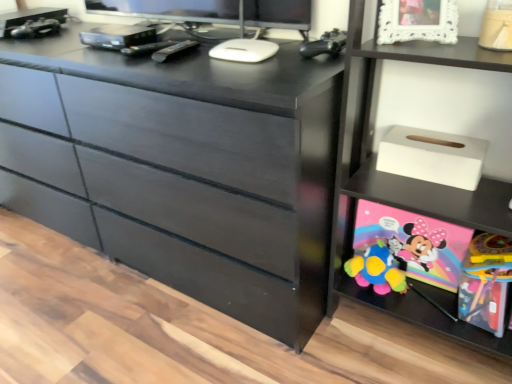
Image resolution: width=512 pixels, height=384 pixels. Find the location of `matte black dresser at center`. matte black dresser at center is located at coordinates (182, 169).

You are a GUI agent. You are given a task and a screenshot of the screen. Output one action in this format:
    pyautogui.click(x=<x>, y=<y>)
    Task: Click on the black plastic remote at center
    The width and height of the screenshot is (512, 384).
    Given the screenshot: What is the action you would take?
    pyautogui.click(x=174, y=50)

Measure the distance between black matte controller at upper right, the first toy viewed from the left, and camera.

black matte controller at upper right, the first toy viewed from the left, and camera are 1.05 meters apart.

Image resolution: width=512 pixels, height=384 pixels. Describe the element at coordinates (324, 44) in the screenshot. I see `black matte controller at upper right, which is the first toy from top to bottom` at that location.

This screenshot has height=384, width=512. What do you see at coordinates (485, 282) in the screenshot?
I see `rubberized plastic toy at lower right, the first toy from the bottom` at bounding box center [485, 282].

Image resolution: width=512 pixels, height=384 pixels. Identify the location of white matte tissue box at upper right. (432, 156).

Is white matte tissue box at upper right to the left or to the right of white matte tissue box at right in the image?

white matte tissue box at upper right is to the left of white matte tissue box at right.

Which is closer, (x=453, y=185) or (x=474, y=206)?

Point (x=453, y=185) is farther from the camera than point (x=474, y=206).

Is white matte tissue box at upper right behind white matte tissue box at right?

Yes, white matte tissue box at upper right is behind white matte tissue box at right.

Looking at this image, is white matte tissue box at upper right smaller than white matte tissue box at right?

Yes, white matte tissue box at upper right is smaller than white matte tissue box at right.

Can you confirm if white matte tissue box at right is smaller than black matte controller at upper right, which is the first toy from top to bottom?

No.

Could you tell me if white matte tissue box at right is facing black matte controller at upper right, the first toy viewed from the left?

No, white matte tissue box at right does not turn towards black matte controller at upper right, the first toy viewed from the left.

Considering the relative sizes of white matte tissue box at right and black matte controller at upper right, which is the first toy from top to bottom, in the image provided, is white matte tissue box at right taller than black matte controller at upper right, which is the first toy from top to bottom,?

Correct, white matte tissue box at right is much taller as black matte controller at upper right, which is the first toy from top to bottom.

Considering their positions, is white matte tissue box at right located in front of or behind black matte controller at upper right, the first toy viewed from the left?

In the image, white matte tissue box at right appears in front of black matte controller at upper right, the first toy viewed from the left.

Considering the relative positions of white lace picture frame at upper right and white matte tissue box at upper right in the image provided, is white lace picture frame at upper right in front of white matte tissue box at upper right?

Yes, it is in front of white matte tissue box at upper right.

Which is correct: white lace picture frame at upper right is inside white matte tissue box at upper right, or outside of it?

white lace picture frame at upper right is not enclosed by white matte tissue box at upper right.

Can you tell me how much white lace picture frame at upper right and white matte tissue box at upper right differ in facing direction?

They differ by 29 degrees in their facing directions.

From the picture: Considering the positions of objects white lace picture frame at upper right and white matte tissue box at upper right in the image provided, who is more to the left, white lace picture frame at upper right or white matte tissue box at upper right?

From the viewer's perspective, white lace picture frame at upper right appears more on the left side.

How much distance is there between black matte controller at upper right, placed as the 2th toy when sorted from right to left, and rubberized plastic toy at lower right, the first toy positioned from the right?

The distance of black matte controller at upper right, placed as the 2th toy when sorted from right to left, from rubberized plastic toy at lower right, the first toy positioned from the right, is 27.04 inches.

From the image's perspective, is black matte controller at upper right, which is the first toy from top to bottom, above or below rubberized plastic toy at lower right, the first toy positioned from the right?

Based on their image positions, black matte controller at upper right, which is the first toy from top to bottom, is located above rubberized plastic toy at lower right, the first toy positioned from the right.

Which object is positioned more to the left, black matte controller at upper right, placed as the 2th toy when sorted from right to left, or rubberized plastic toy at lower right, the first toy from the bottom?

Positioned to the left is black matte controller at upper right, placed as the 2th toy when sorted from right to left.

Where is `toy above the rubberized plastic toy at lower right, the 2th toy in the top-to-bottom sequence (from the image's perspective)`? toy above the rubberized plastic toy at lower right, the 2th toy in the top-to-bottom sequence (from the image's perspective) is located at coordinates (324, 44).

Who is more distant, white matte tissue box at right or white matte tissue box at upper right?

Positioned behind is white matte tissue box at upper right.

Considering the relative sizes of white matte tissue box at right and white matte tissue box at upper right in the image provided, is white matte tissue box at right smaller than white matte tissue box at upper right?

No, white matte tissue box at right is not smaller than white matte tissue box at upper right.

Does white matte tissue box at right appear on the right side of white matte tissue box at upper right?

Correct, you'll find white matte tissue box at right to the right of white matte tissue box at upper right.

Does white matte tissue box at right contain white matte tissue box at upper right?

That's correct, white matte tissue box at upper right is inside white matte tissue box at right.

Can we say white lace picture frame at upper right lies outside matte black dresser at center?

Indeed, white lace picture frame at upper right is completely outside matte black dresser at center.

Which is behind, white lace picture frame at upper right or matte black dresser at center?

white lace picture frame at upper right is further away from the camera.

Does white lace picture frame at upper right appear on the left side of matte black dresser at center?

No.

How different are the orientations of rubberized plastic toy at lower right, the 2th toy in the top-to-bottom sequence, and matte black dresser at center in degrees?

rubberized plastic toy at lower right, the 2th toy in the top-to-bottom sequence, and matte black dresser at center are facing 5.12e-05 degrees away from each other.

In the scene shown: Would you consider rubberized plastic toy at lower right, the first toy positioned from the right, to be distant from matte black dresser at center?

That's not correct — rubberized plastic toy at lower right, the first toy positioned from the right, is a little close to matte black dresser at center.

Considering the sizes of rubberized plastic toy at lower right, the first toy positioned from the right, and matte black dresser at center in the image, is rubberized plastic toy at lower right, the first toy positioned from the right, bigger or smaller than matte black dresser at center?

Considering their sizes, rubberized plastic toy at lower right, the first toy positioned from the right, takes up less space than matte black dresser at center.

From the matte black dresser at center, count 1st toys backward and point to it. Please provide its 2D coordinates.

[(485, 282)]

Identify the location of shelf located underneath the white matte tissue box at upper right (from a real-world perspective). This screenshot has width=512, height=384. (374, 136).

What are the coordinates of `toy to the left of white matte tissue box at right` in the screenshot? It's located at (324, 44).

Considering their positions, is black plastic remote at center positioned closer to white matte tissue box at right than white lace picture frame at upper right?

white lace picture frame at upper right.

When comparing their distances from white matte tissue box at right, does matte black dresser at center or white matte tissue box at upper right seem further?

The object further to white matte tissue box at right is matte black dresser at center.

Estimate the real-world distances between objects in this image. Which object is closer to white matte tissue box at upper right, black matte controller at upper right, the first toy viewed from the left, or matte black dresser at center?

black matte controller at upper right, the first toy viewed from the left, is closer to white matte tissue box at upper right.

Based on their spatial positions, is rubberized plastic toy at lower right, the first toy positioned from the right, or black plastic remote at center further from white lace picture frame at upper right?

rubberized plastic toy at lower right, the first toy positioned from the right, is positioned further to the anchor white lace picture frame at upper right.

Considering their positions, is rubberized plastic toy at lower right, the 2th toy in the top-to-bottom sequence, positioned further to black plastic remote at center than white matte tissue box at right?

Among the two, rubberized plastic toy at lower right, the 2th toy in the top-to-bottom sequence, is located further to black plastic remote at center.

When comparing their distances from black matte controller at upper right, the first toy viewed from the left, does white matte tissue box at upper right or white matte tissue box at right seem closer?

white matte tissue box at upper right.

Considering their positions, is white lace picture frame at upper right positioned further to matte black dresser at center than black matte controller at upper right, which is the first toy from top to bottom?

white lace picture frame at upper right is positioned further to the anchor matte black dresser at center.

Estimate the real-world distances between objects in this image. Which object is further from matte black dresser at center, white matte tissue box at upper right or white matte tissue box at right?

Based on the image, white matte tissue box at upper right appears to be further to matte black dresser at center.

At what (x,y) coordinates should I click in order to perform the action: click on toy between black plastic remote at center and white matte tissue box at right in the horizontal direction. Please return your answer as a coordinate pair (x, y). Looking at the image, I should click on (324, 44).

Identify the location of toy situated between black plastic remote at center and white lace picture frame at upper right from left to right. This screenshot has height=384, width=512. [324, 44].

This screenshot has height=384, width=512. Find the location of `toy between white lace picture frame at upper right and rubberized plastic toy at lower right, the first toy positioned from the right, from top to bottom`. toy between white lace picture frame at upper right and rubberized plastic toy at lower right, the first toy positioned from the right, from top to bottom is located at coordinates (324, 44).

What are the coordinates of `shelf between black plastic remote at center and rubberized plastic toy at lower right, the second toy in the left-to-right sequence, in the horizontal direction` in the screenshot? It's located at (374, 136).